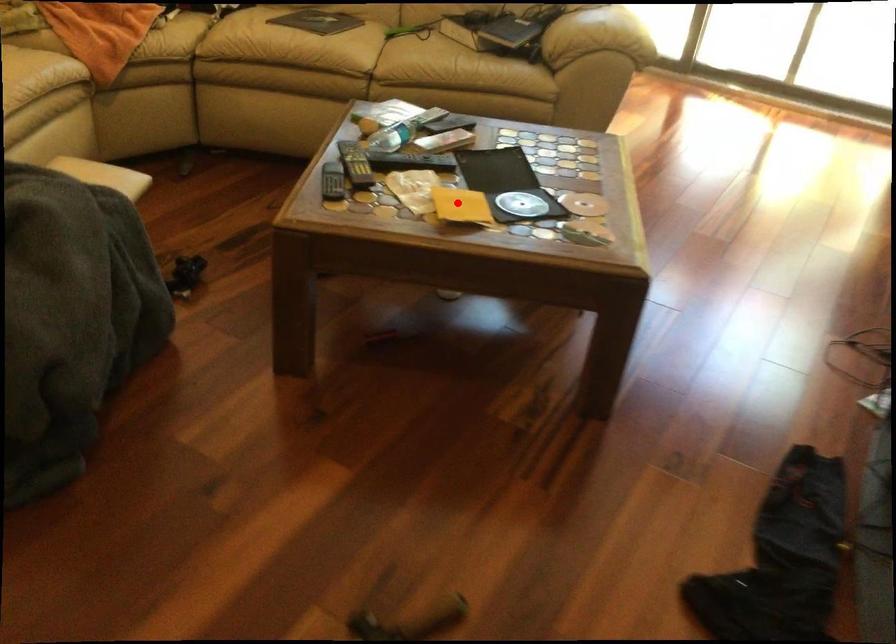
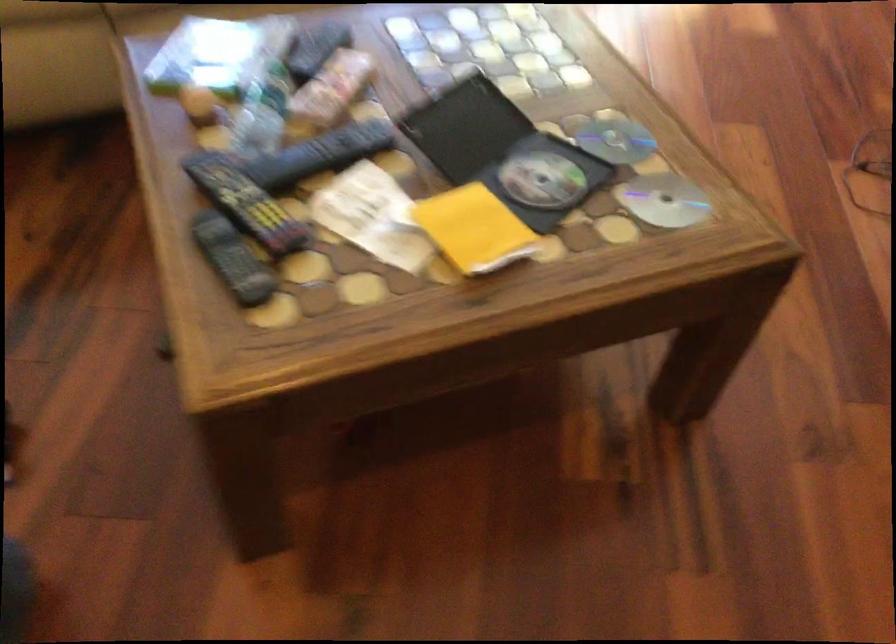
The point at the highlighted location is marked in the first image. Where is the corresponding point in the second image?

(474, 229)